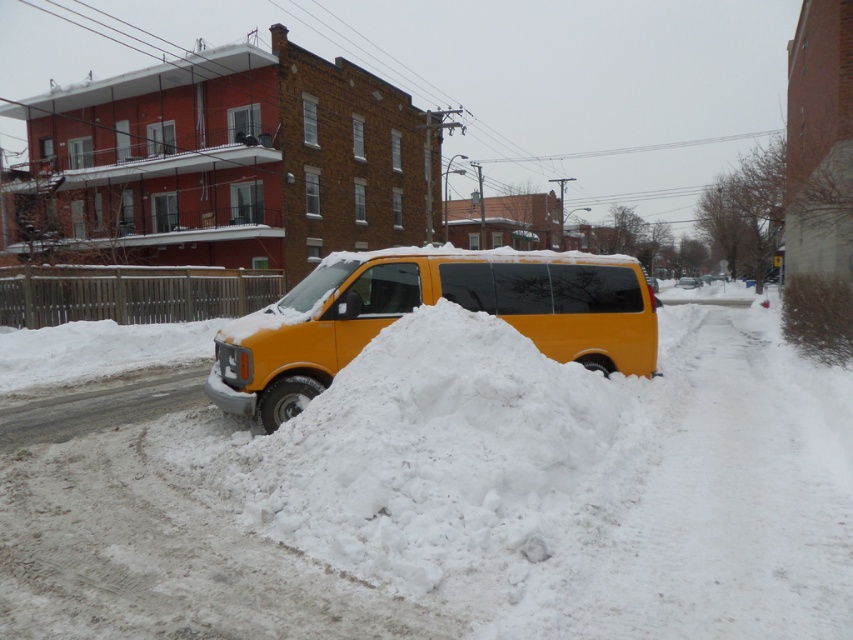
Does snowy white mound at center have a lesser width compared to yellow matte van at center?

In fact, snowy white mound at center might be wider than yellow matte van at center.

Does point (556, 477) come in front of point (297, 289)?

That is True.

Is point (515, 454) positioned behind point (434, 280)?

No, (515, 454) is closer to viewer.

Where is `snowy white mound at center`? snowy white mound at center is located at coordinates (444, 454).